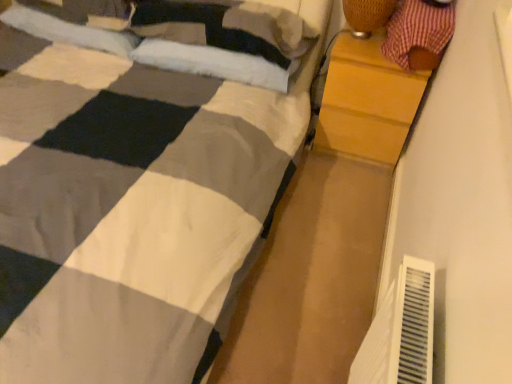
Question: Is white soft pillow at upper center, which is counted as the first pillow, starting from the right, in front of or behind red plaid fabric at upper right in the image?

Choices:
 (A) behind
 (B) front

Answer: (A)

Question: From the image's perspective, relative to red plaid fabric at upper right, is white soft pillow at upper center, which ranks as the third pillow in left-to-right order, above or below?

Choices:
 (A) above
 (B) below

Answer: (A)

Question: Considering the real-world distances, which object is closest to the wooden chest of drawers at right?

Choices:
 (A) soft white pillow at upper left, positioned as the second pillow in left-to-right order
 (B) red plaid fabric at upper right
 (C) soft white pillow at upper left, positioned as the 3th pillow in right-to-left order
 (D) white soft pillow at upper center, which ranks as the third pillow in left-to-right order
 (E) woven bamboo lampshade at upper right

Answer: (B)

Question: Estimate the real-world distances between objects in this image. Which object is closer to the woven bamboo lampshade at upper right?

Choices:
 (A) white soft pillow at upper center, which is counted as the first pillow, starting from the right
 (B) red plaid fabric at upper right
 (C) wooden chest of drawers at right
 (D) soft white pillow at upper left, positioned as the second pillow in left-to-right order
 (E) soft white pillow at upper left, positioned as the 3th pillow in right-to-left order

Answer: (B)